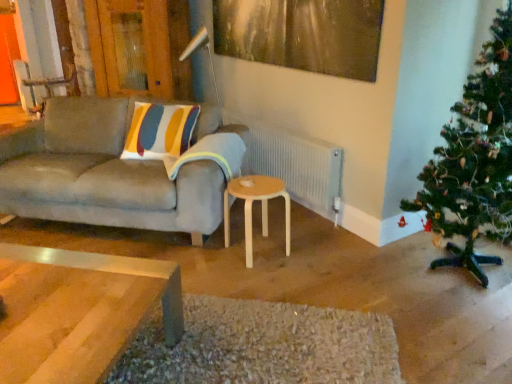
Question: Could striped fabric pillow at center be considered to be inside wooden armchair at upper left?

Choices:
 (A) yes
 (B) no

Answer: (B)

Question: Does wooden armchair at upper left lie behind striped fabric pillow at center?

Choices:
 (A) no
 (B) yes

Answer: (B)

Question: Does wooden armchair at upper left have a greater height compared to striped fabric pillow at center?

Choices:
 (A) yes
 (B) no

Answer: (A)

Question: From a real-world perspective, is wooden armchair at upper left positioned under striped fabric pillow at center based on gravity?

Choices:
 (A) yes
 (B) no

Answer: (B)

Question: Is the surface of wooden armchair at upper left in direct contact with striped fabric pillow at center?

Choices:
 (A) no
 (B) yes

Answer: (A)

Question: Is wooden armchair at upper left shorter than striped fabric pillow at center?

Choices:
 (A) yes
 (B) no

Answer: (B)

Question: Does natural wood stool at center have a smaller size compared to matte gray couch at left?

Choices:
 (A) no
 (B) yes

Answer: (B)

Question: Is natural wood stool at center shorter than matte gray couch at left?

Choices:
 (A) no
 (B) yes

Answer: (B)

Question: Is natural wood stool at center bigger than matte gray couch at left?

Choices:
 (A) no
 (B) yes

Answer: (A)

Question: Is natural wood stool at center wider than matte gray couch at left?

Choices:
 (A) no
 (B) yes

Answer: (A)

Question: Would you say natural wood stool at center is outside matte gray couch at left?

Choices:
 (A) yes
 (B) no

Answer: (A)

Question: Is natural wood stool at center in contact with matte gray couch at left?

Choices:
 (A) no
 (B) yes

Answer: (A)

Question: Would you consider metallic gold painting at upper center to be distant from striped fabric pillow at center?

Choices:
 (A) no
 (B) yes

Answer: (A)